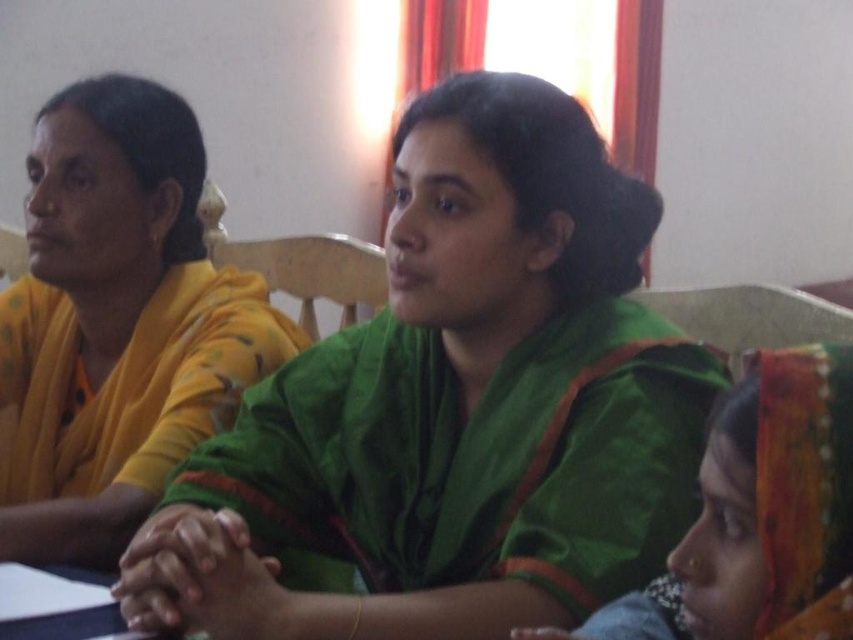
Can you confirm if green silk saree at center is positioned to the left of green velvet sari at center?

Yes, green silk saree at center is to the left of green velvet sari at center.

Who is lower down, green silk saree at center or green velvet sari at center?

green velvet sari at center is lower down.

The height and width of the screenshot is (640, 853). Find the location of `green silk saree at center`. green silk saree at center is located at coordinates (457, 406).

How much distance is there between green silk saree at center and yellow fabric saree at left?

green silk saree at center and yellow fabric saree at left are 13.95 inches apart.

The height and width of the screenshot is (640, 853). I want to click on green silk saree at center, so click(x=457, y=406).

This screenshot has height=640, width=853. In order to click on green silk saree at center in this screenshot , I will do `click(457, 406)`.

Describe the element at coordinates (117, 323) in the screenshot. I see `yellow fabric saree at left` at that location.

Is yellow fabric saree at left smaller than green velvet sari at center?

No.

Which is behind, point (119, 84) or point (846, 612)?

Positioned behind is point (119, 84).

What are the coordinates of `yellow fabric saree at left` in the screenshot? It's located at (117, 323).